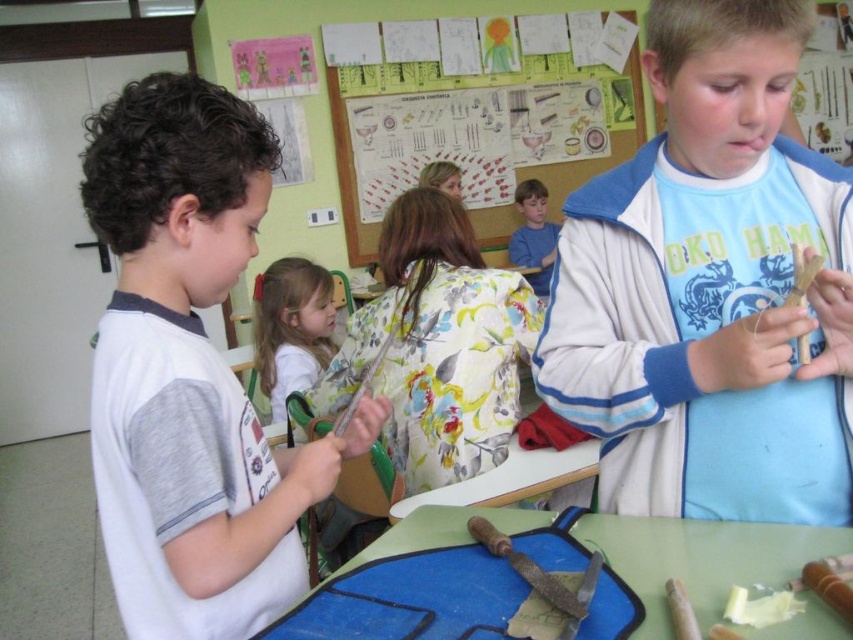
Is point (486, 636) closer to viewer compared to point (357, 220)?

Yes, point (486, 636) is in front of point (357, 220).

What do you see at coordinates (546, 570) in the screenshot?
I see `blue fabric at lower center` at bounding box center [546, 570].

Where is `blue fabric at lower center`? blue fabric at lower center is located at coordinates (546, 570).

Does point (196, 413) come farther from viewer compared to point (392, 134)?

No, it is not.

The image size is (853, 640). In order to click on white matte shirt at left in this screenshot , I will do `click(190, 371)`.

Is point (199, 452) closer to viewer compared to point (635, 634)?

No, it is behind (635, 634).

Who is more forward, (x=263, y=444) or (x=650, y=625)?

Positioned in front is point (x=650, y=625).

Identify the location of white matte shirt at left. The image size is (853, 640). (190, 371).